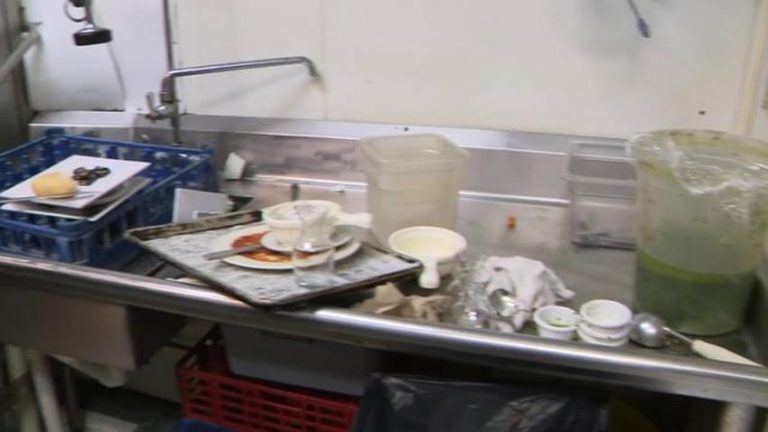
Identify the location of faucet. (203, 69).